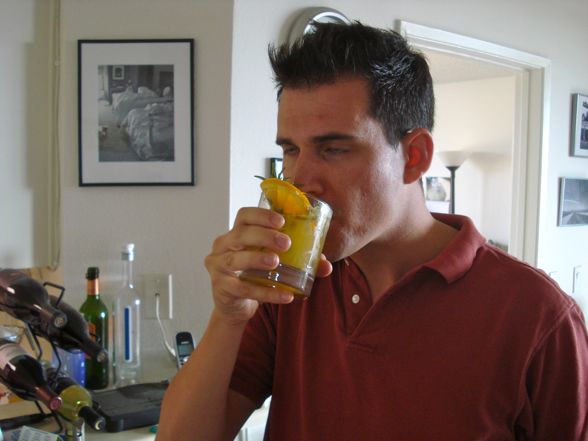
This screenshot has height=441, width=588. Identify the location of cord. (165, 321).